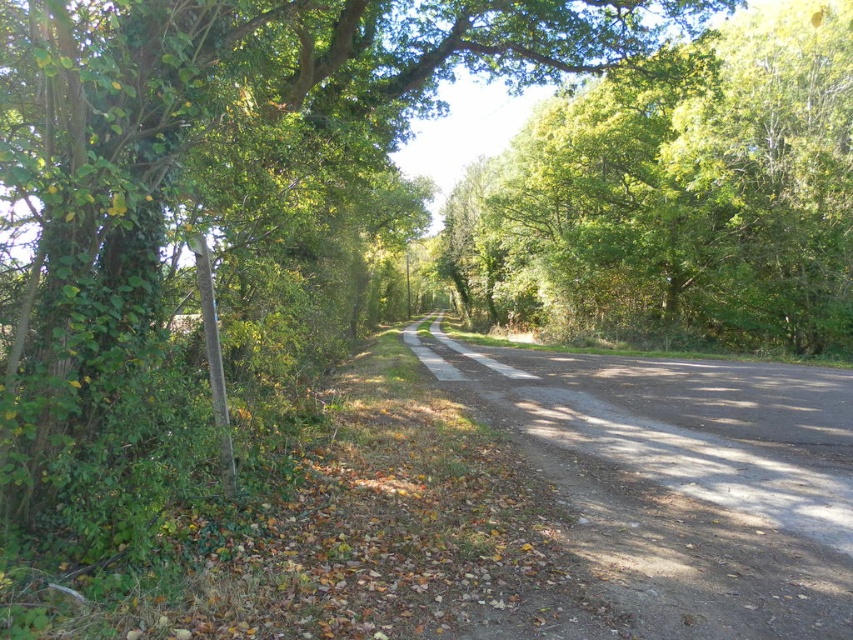
Is green leafy tree at left taller than green leafy tree at upper center?

No.

Is green leafy tree at left smaller than green leafy tree at upper center?

Correct, green leafy tree at left occupies less space than green leafy tree at upper center.

Is point (367, 180) less distant than point (733, 112)?

That is True.

At what (x,y) coordinates should I click in order to perform the action: click on green leafy tree at left. Please return your answer as a coordinate pair (x, y). Looking at the image, I should click on (223, 170).